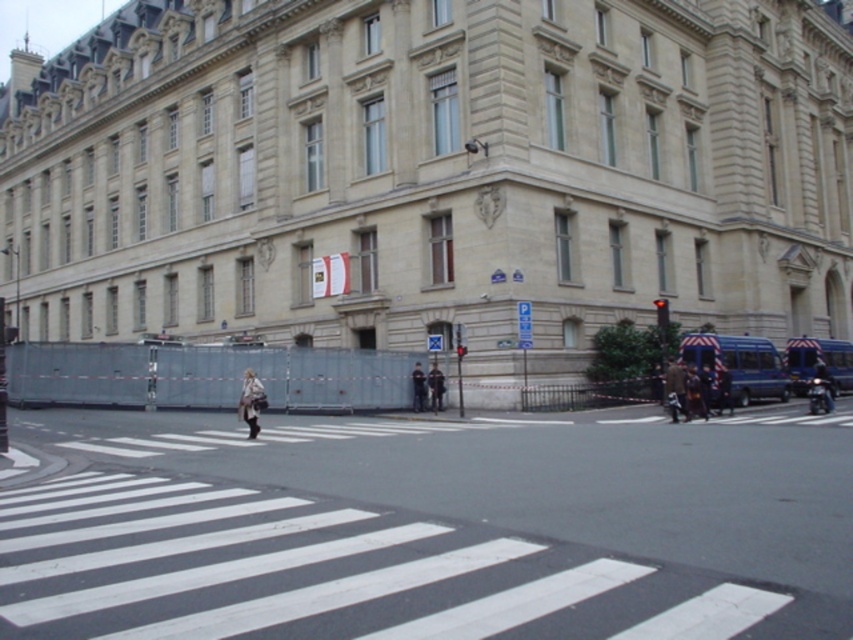
Question: Which object is positioned farthest from the light beige fabric coat at center?

Choices:
 (A) white asphalt crosswalk at center
 (B) dark gray uniform at center
 (C) dark gray jacket at center
 (D) dark brown leather jacket at right

Answer: (D)

Question: Does brown leather jacket at center have a smaller size compared to dark gray jacket at center?

Choices:
 (A) no
 (B) yes

Answer: (A)

Question: Is dark blue leather jacket at lower right in front of brown leather jacket at center?

Choices:
 (A) no
 (B) yes

Answer: (A)

Question: Estimate the real-world distances between objects in this image. Which object is farther from the light beige fabric coat at center?

Choices:
 (A) dark gray uniform at center
 (B) dark brown leather jacket at right
 (C) white asphalt crosswalk at center

Answer: (B)

Question: Is light beige fabric coat at center wider than dark brown leather jacket at right?

Choices:
 (A) no
 (B) yes

Answer: (B)

Question: Estimate the real-world distances between objects in this image. Which object is closer to the white asphalt crosswalk at center?

Choices:
 (A) light beige fabric coat at center
 (B) brown leather jacket at center

Answer: (A)